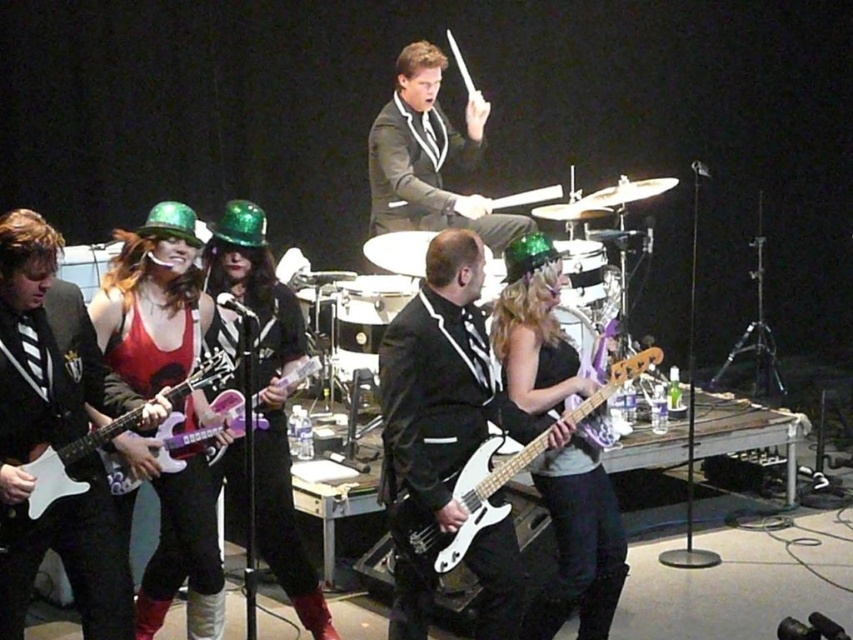
Question: Which object is closer to the camera taking this photo?

Choices:
 (A) black satin suit at center
 (B) shiny silver drum at center

Answer: (B)

Question: Does purple glossy electric guitar at lower left lie in front of purple glossy electric guitar at center?

Choices:
 (A) yes
 (B) no

Answer: (A)

Question: Can you confirm if shiny black bass guitar at center is positioned below black satin suit at center?

Choices:
 (A) yes
 (B) no

Answer: (A)

Question: Which point appears closest to the camera in this image?

Choices:
 (A) (596, 243)
 (B) (637, 364)

Answer: (B)

Question: From the image, what is the correct spatial relationship of white glossy bass guitar at center in relation to brushed metal drum at center?

Choices:
 (A) above
 (B) below

Answer: (B)

Question: Which is nearer to the shiny black bass guitar at center?

Choices:
 (A) black satin suit at center
 (B) white glossy bass guitar at center

Answer: (B)